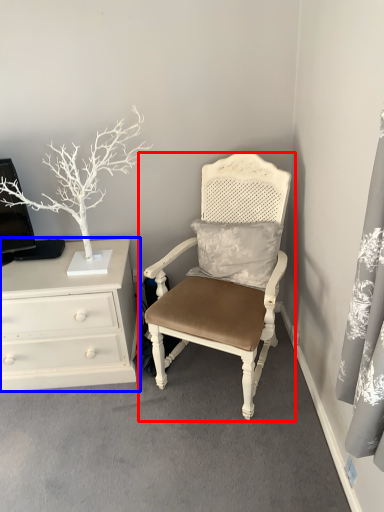
Question: Which of the following is the closest to the observer, chair (highlighted by a red box) or chest of drawers (highlighted by a blue box)?

Choices:
 (A) chair
 (B) chest of drawers

Answer: (A)